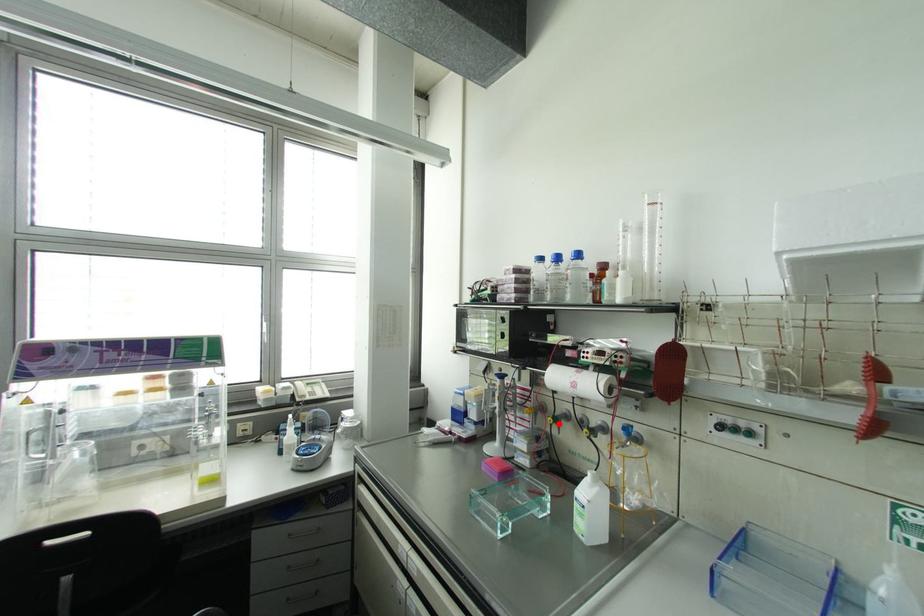
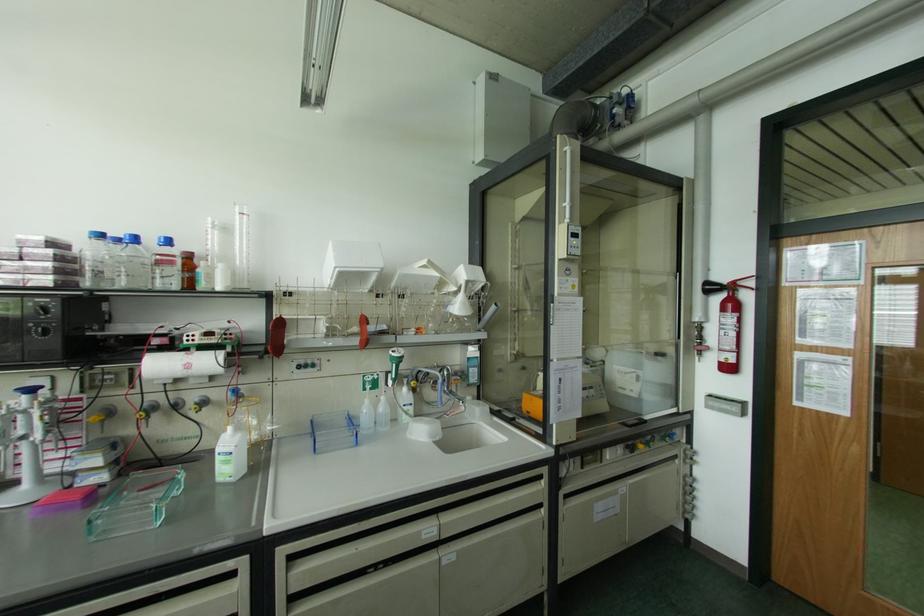
The point at the highlighted location is marked in the first image. Where is the corresponding point in the second image?

(148, 416)